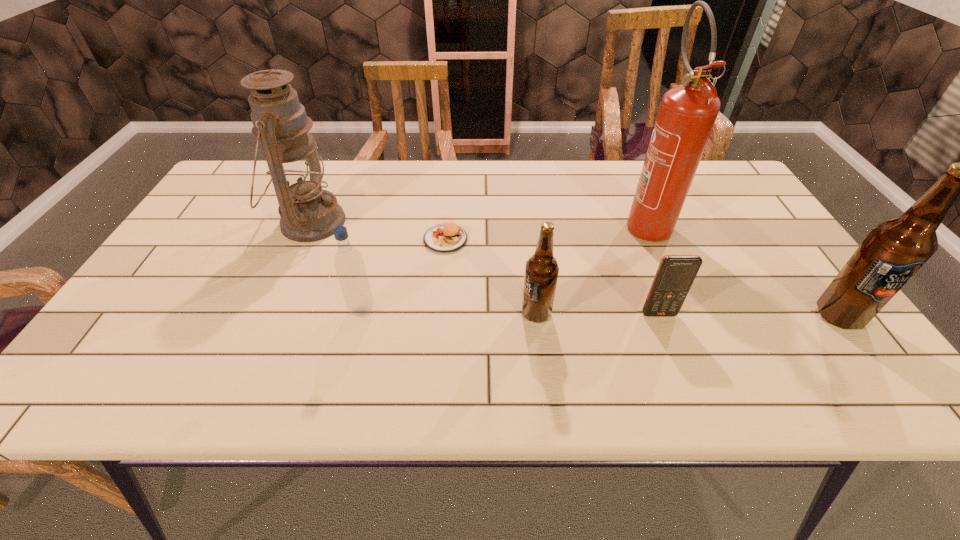
This screenshot has height=540, width=960. Identify the location of the shorter beer bottle. (541, 272).

Locate an element on the screen. the fourth object from left to right is located at coordinates (541, 272).

Locate an element on the screen. The image size is (960, 540). the taller beer bottle is located at coordinates (894, 250).

Locate an element on the screen. the right beer bottle is located at coordinates (894, 250).

You are a GUI agent. You are given a task and a screenshot of the screen. Output one action in this format:
    pyautogui.click(x=<x>, y=<y>)
    Task: Click on the fire extinguisher
    Image resolution: width=960 pixels, height=540 pixels.
    Given the screenshot: What is the action you would take?
    pyautogui.click(x=687, y=114)

At what (x,y) coordinates should I click in order to perform the action: click on the third object from left to right. Please return your answer as a coordinate pair (x, y). The width and height of the screenshot is (960, 540). Looking at the image, I should click on (443, 238).

Locate an element on the screen. The image size is (960, 540). the shortest object is located at coordinates (443, 238).

Find the location of a particular element. the leftmost object is located at coordinates (309, 213).

The width and height of the screenshot is (960, 540). I want to click on cellular telephone, so click(675, 275).

You are a GUI agent. You are given a task and a screenshot of the screen. Output one action in this format:
    pyautogui.click(x=<x>, y=<y>)
    Task: Click on the water bottle
    The height and width of the screenshot is (540, 960).
    Given the screenshot: What is the action you would take?
    pyautogui.click(x=349, y=264)